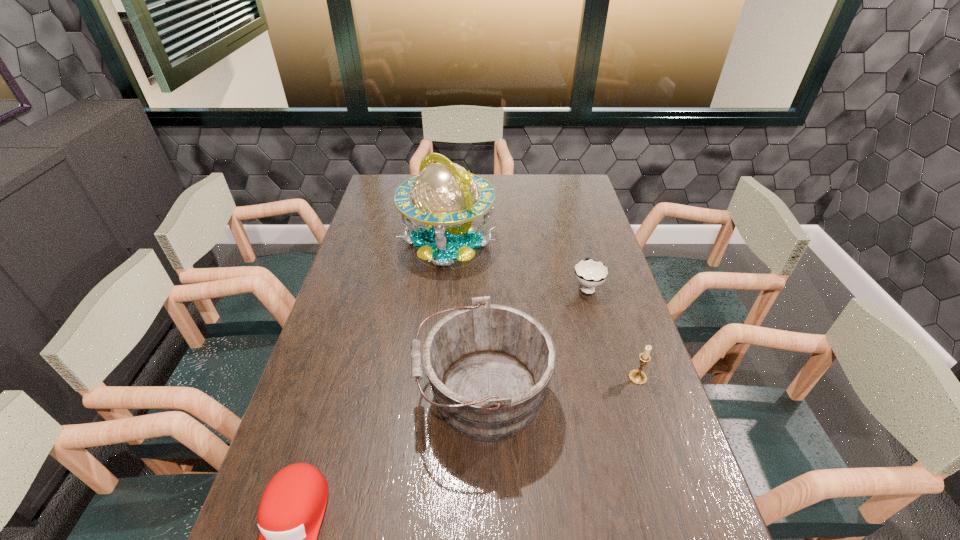
Locate an element on the screen. The width and height of the screenshot is (960, 540). globe is located at coordinates (444, 195).

Find the location of a particular element. The image size is (960, 540). wine bucket is located at coordinates (489, 365).

Find the location of a particular element. This screenshot has height=540, width=960. the third tallest object is located at coordinates 638,377.

The image size is (960, 540). I want to click on cup, so click(589, 273).

Where is `vacant area situated on the back of the tallest object`? vacant area situated on the back of the tallest object is located at coordinates (452, 191).

This screenshot has width=960, height=540. Identify the location of free space located on the left of the wine bucket. (323, 394).

Find the location of a particular element. Image resolution: width=960 pixels, height=540 pixels. vacant point located 0.110m on the front of the third tallest object is located at coordinates (653, 423).

Find the location of a particular element. Image resolution: width=960 pixels, height=540 pixels. vacant area situated 0.350m on the side of the cup with the handle is located at coordinates tap(567, 217).

This screenshot has height=540, width=960. Identify the location of blank area located 0.180m on the side of the cup with the handle. (575, 242).

Find the location of a particular element. Image resolution: width=960 pixels, height=540 pixels. vacant space located on the side of the cup with the handle is located at coordinates (569, 224).